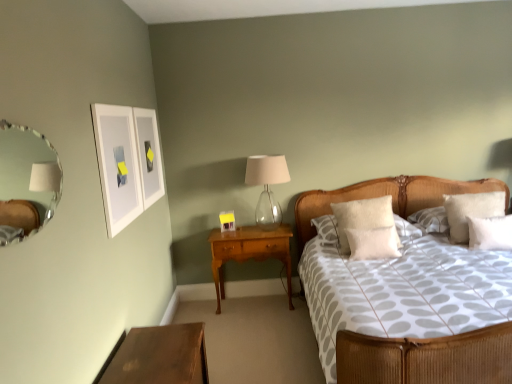
Question: Can you confirm if white soft pillow at center, which is counted as the 3th pillow, starting from the right, is smaller than white fluffy pillow at center, the first pillow from the left?

Choices:
 (A) yes
 (B) no

Answer: (A)

Question: Is white soft pillow at center, which is counted as the 3th pillow, starting from the right, taller than white fluffy pillow at center, positioned as the 4th pillow in right-to-left order?

Choices:
 (A) no
 (B) yes

Answer: (A)

Question: Is white soft pillow at center, the 2th pillow positioned from the left, in front of white fluffy pillow at center, positioned as the 4th pillow in right-to-left order?

Choices:
 (A) no
 (B) yes

Answer: (B)

Question: From the image's perspective, does white soft pillow at center, the 2th pillow positioned from the left, appear lower than white fluffy pillow at center, positioned as the 4th pillow in right-to-left order?

Choices:
 (A) yes
 (B) no

Answer: (A)

Question: Is white soft pillow at center, the 2th pillow positioned from the left, further to camera compared to white fluffy pillow at center, positioned as the 4th pillow in right-to-left order?

Choices:
 (A) yes
 (B) no

Answer: (B)

Question: Is white soft pillow at center, which is counted as the 3th pillow, starting from the right, in front of or behind wooden nightstand at center, positioned as the first nightstand in right-to-left order, in the image?

Choices:
 (A) front
 (B) behind

Answer: (A)

Question: In terms of height, does white soft pillow at center, the 2th pillow positioned from the left, look taller or shorter compared to wooden nightstand at center, marked as the 2th nightstand in a front-to-back arrangement?

Choices:
 (A) tall
 (B) short

Answer: (B)

Question: Is point (385, 231) closer or farther from the camera than point (273, 233)?

Choices:
 (A) farther
 (B) closer

Answer: (B)

Question: Visually, is white soft pillow at center, the 2th pillow positioned from the left, positioned to the left or to the right of wooden nightstand at center, positioned as the first nightstand in right-to-left order?

Choices:
 (A) left
 (B) right

Answer: (B)

Question: Would you say white fluffy pillow at center, the first pillow from the left, is to the left or to the right of wooden nightstand at center, positioned as the first nightstand in right-to-left order, in the picture?

Choices:
 (A) right
 (B) left

Answer: (A)

Question: Looking at the image, does white fluffy pillow at center, positioned as the 4th pillow in right-to-left order, seem bigger or smaller compared to wooden nightstand at center, placed as the 1th nightstand when sorted from back to front?

Choices:
 (A) big
 (B) small

Answer: (B)

Question: Looking at their shapes, would you say white fluffy pillow at center, positioned as the 4th pillow in right-to-left order, is wider or thinner than wooden nightstand at center, positioned as the first nightstand in right-to-left order?

Choices:
 (A) wide
 (B) thin

Answer: (B)

Question: Is white fluffy pillow at center, the first pillow from the left, taller or shorter than wooden nightstand at center, positioned as the first nightstand in right-to-left order?

Choices:
 (A) short
 (B) tall

Answer: (A)

Question: In terms of width, does white soft pillow at right, which ranks as the 2th pillow in right-to-left order, look wider or thinner when compared to white matte picture frame at upper left?

Choices:
 (A) wide
 (B) thin

Answer: (A)

Question: Considering the positions of white soft pillow at right, positioned as the 3th pillow in left-to-right order, and white matte picture frame at upper left in the image, is white soft pillow at right, positioned as the 3th pillow in left-to-right order, bigger or smaller than white matte picture frame at upper left?

Choices:
 (A) small
 (B) big

Answer: (B)